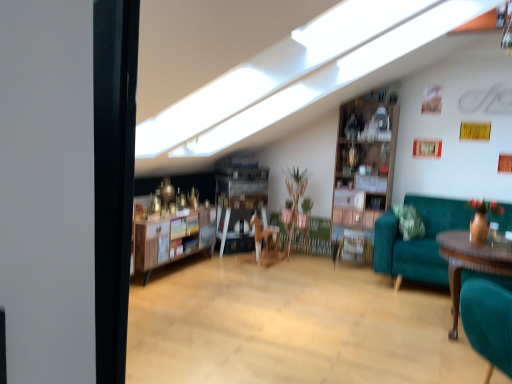
Question: Considering the relative positions of wooden shelf at center and teal fabric couch at right in the image provided, is wooden shelf at center behind teal fabric couch at right?

Choices:
 (A) yes
 (B) no

Answer: (A)

Question: From a real-world perspective, does wooden shelf at center sit lower than teal fabric couch at right?

Choices:
 (A) no
 (B) yes

Answer: (B)

Question: Can you confirm if wooden shelf at center is positioned to the right of teal fabric couch at right?

Choices:
 (A) no
 (B) yes

Answer: (A)

Question: Is wooden shelf at center far away from teal fabric couch at right?

Choices:
 (A) yes
 (B) no

Answer: (A)

Question: From a real-world perspective, is wooden shelf at center over teal fabric couch at right?

Choices:
 (A) no
 (B) yes

Answer: (A)

Question: Is wooden shelf at center positioned beyond the bounds of teal fabric couch at right?

Choices:
 (A) no
 (B) yes

Answer: (B)

Question: Considering the relative positions of wooden polished table at right and teal fabric couch at right in the image provided, is wooden polished table at right behind teal fabric couch at right?

Choices:
 (A) no
 (B) yes

Answer: (A)

Question: From the image's perspective, does wooden polished table at right appear lower than teal fabric couch at right?

Choices:
 (A) yes
 (B) no

Answer: (A)

Question: Does wooden polished table at right have a smaller size compared to teal fabric couch at right?

Choices:
 (A) yes
 (B) no

Answer: (A)

Question: Can you confirm if wooden polished table at right is bigger than teal fabric couch at right?

Choices:
 (A) yes
 (B) no

Answer: (B)

Question: Does wooden polished table at right lie in front of teal fabric couch at right?

Choices:
 (A) no
 (B) yes

Answer: (B)

Question: Is wooden polished table at right far away from teal fabric couch at right?

Choices:
 (A) no
 (B) yes

Answer: (A)

Question: Is the depth of wooden shelf at center greater than that of wooden polished table at right?

Choices:
 (A) no
 (B) yes

Answer: (B)